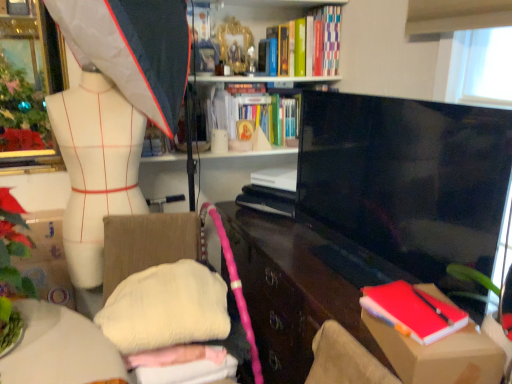
Question: Is point (309, 72) closer or farther from the camera than point (96, 74)?

Choices:
 (A) closer
 (B) farther

Answer: (B)

Question: Is green matte book at upper center, the 3th book when ordered from bottom to top, situated inside white matte mannequin torso at left or outside?

Choices:
 (A) inside
 (B) outside

Answer: (B)

Question: Considering the real-world distances, which object is closest to the cardboard box at lower right?

Choices:
 (A) green leafy plant at left
 (B) white soft cushion at center
 (C) white matte mannequin torso at left
 (D) matte red notebook at lower right, which is the third book from top to bottom
 (E) hardcover book at upper center, positioned as the third book in front-to-back order

Answer: (D)

Question: Which is nearer to the cardboard box at lower right?

Choices:
 (A) white soft cushion at center
 (B) matte black cabinet at center
 (C) green leafy plant at left
 (D) green matte book at upper center, the 2th book in the front-to-back sequence
 (E) matte red notebook at lower right, which is the third book from top to bottom

Answer: (E)